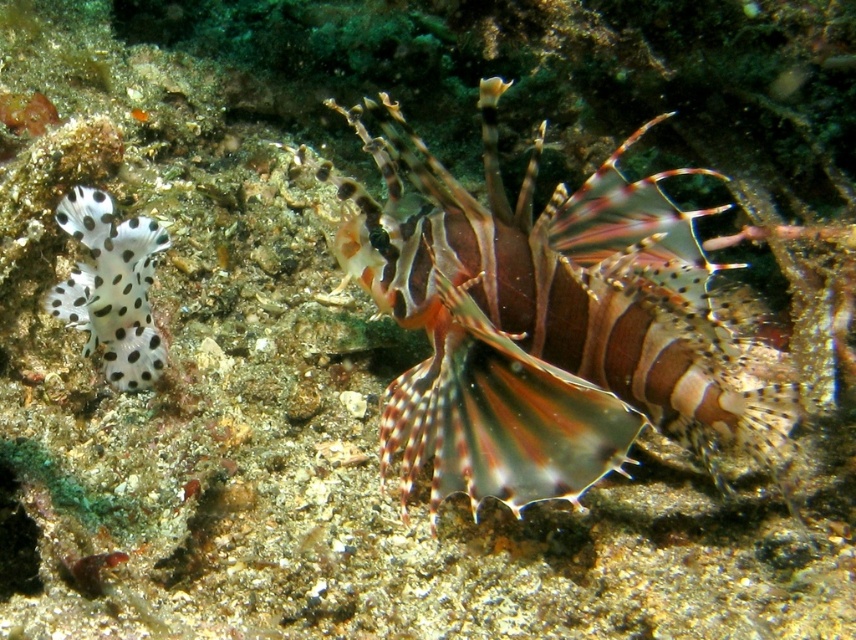
Does multicolored spiny fish at center appear under white spotted sponge at left?

Correct, multicolored spiny fish at center is located below white spotted sponge at left.

This screenshot has width=856, height=640. Describe the element at coordinates (541, 321) in the screenshot. I see `multicolored spiny fish at center` at that location.

Find the location of `multicolored spiny fish at center`. multicolored spiny fish at center is located at coordinates (541, 321).